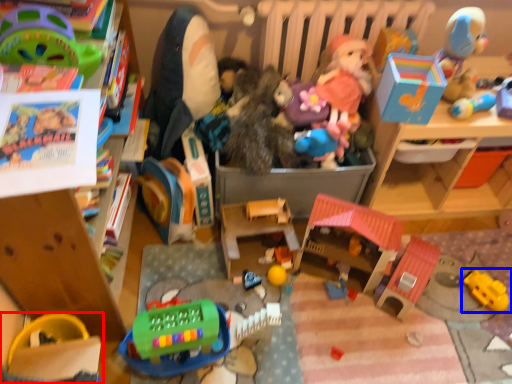
Question: Which object appears closest to the camera in this image, toy (highlighted by a red box) or toy (highlighted by a blue box)?

Choices:
 (A) toy
 (B) toy

Answer: (A)